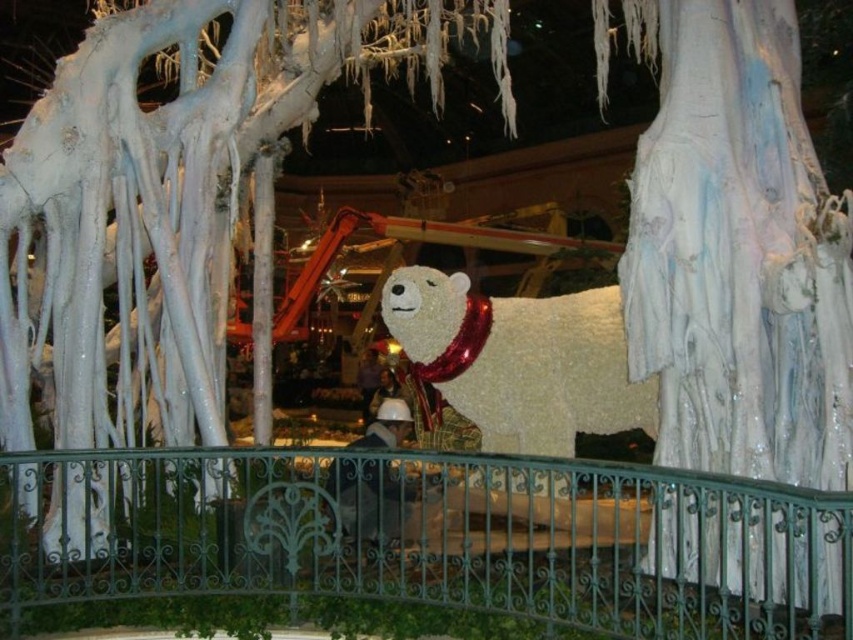
You are standing in front of the festive display and want to locate the green wrought iron railing at center. Based on the coordinates provided, where would you look to find it?

The green wrought iron railing at center is located at point (433, 536).

You are a visitor standing in front of the festive display. You want to take a photo of the white fluffy polar bear at center without any obstructions. Is the green wrought iron railing at center blocking your view of the polar bear?

The green wrought iron railing at center is shorter than the white fluffy polar bear at center, so the railing won not block your view of the polar bear.

You are a maintenance worker needing to clean the white fluffy polar bear at center. You have a 4 feet long pole. Can you reach the polar bear from the green wrought iron railing at center using the pole?

The distance between the green wrought iron railing at center and the white fluffy polar bear at center is 3.99 feet. Since the pole is 4 feet long, it is just long enough to reach the polar bear from the railing.